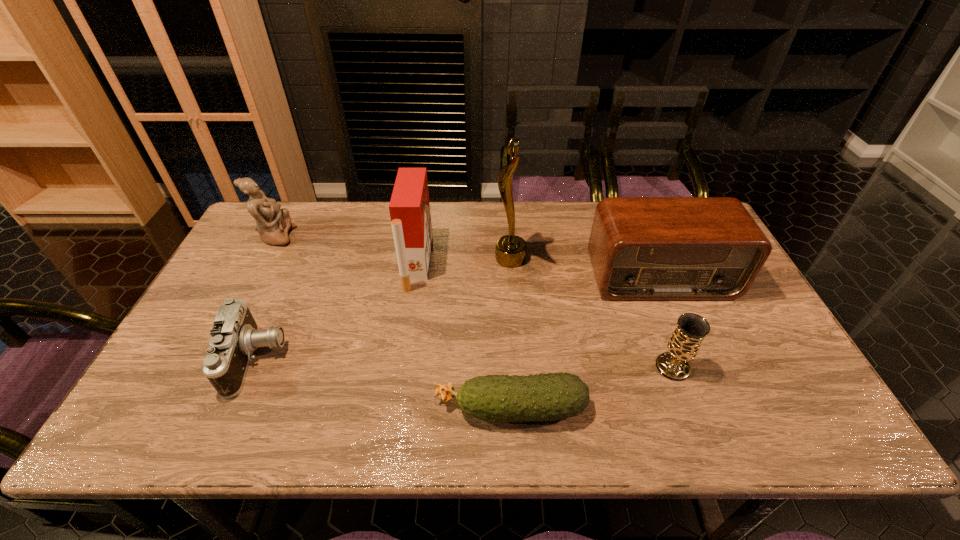
Image resolution: width=960 pixels, height=540 pixels. In order to click on award in this screenshot , I will do click(510, 250).

What are the coordinates of `the fifth object from right to left` in the screenshot? It's located at (409, 207).

Where is `the second tallest object`? the second tallest object is located at coordinates (409, 207).

At what (x,y) coordinates should I click in order to perform the action: click on figurine. Please return your answer as a coordinate pair (x, y). This screenshot has width=960, height=540. Looking at the image, I should click on (273, 223).

Locate an element on the screen. This screenshot has width=960, height=540. radio receiver is located at coordinates (641, 248).

Where is `chalice`? chalice is located at coordinates (683, 345).

Where is `camera`? This screenshot has width=960, height=540. camera is located at coordinates (235, 335).

This screenshot has height=540, width=960. I want to click on the shortest object, so click(x=541, y=397).

In order to click on blank space located 0.320m on the front-facing side of the tallest object in this screenshot , I will do `click(391, 259)`.

Locate an element on the screen. free space located on the front-facing side of the tallest object is located at coordinates (369, 259).